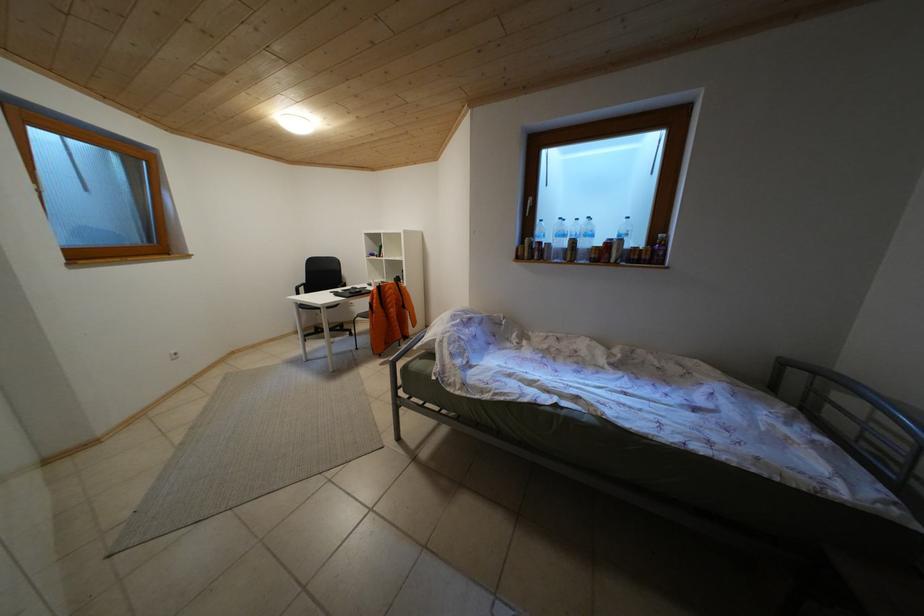
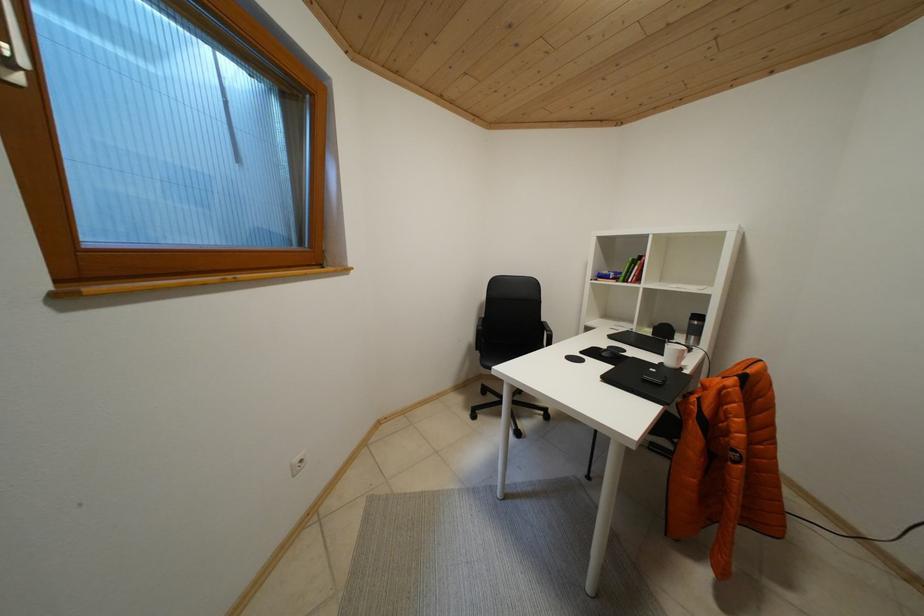
The images are taken continuously from a first-person perspective. In which direction are you moving?

The cameraman moved toward left, forward.